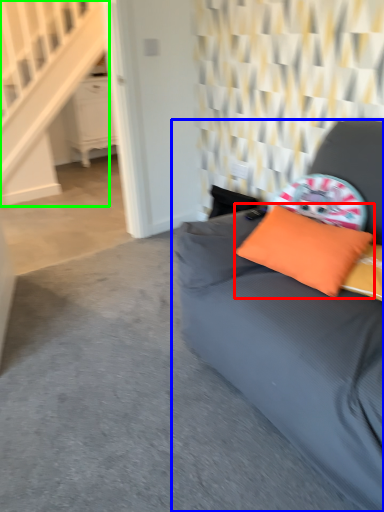
Question: Which object is the farthest from pillow (highlighted by a red box)? Choose among these: studio couch (highlighted by a blue box) or stairwell (highlighted by a green box).

Choices:
 (A) studio couch
 (B) stairwell

Answer: (B)